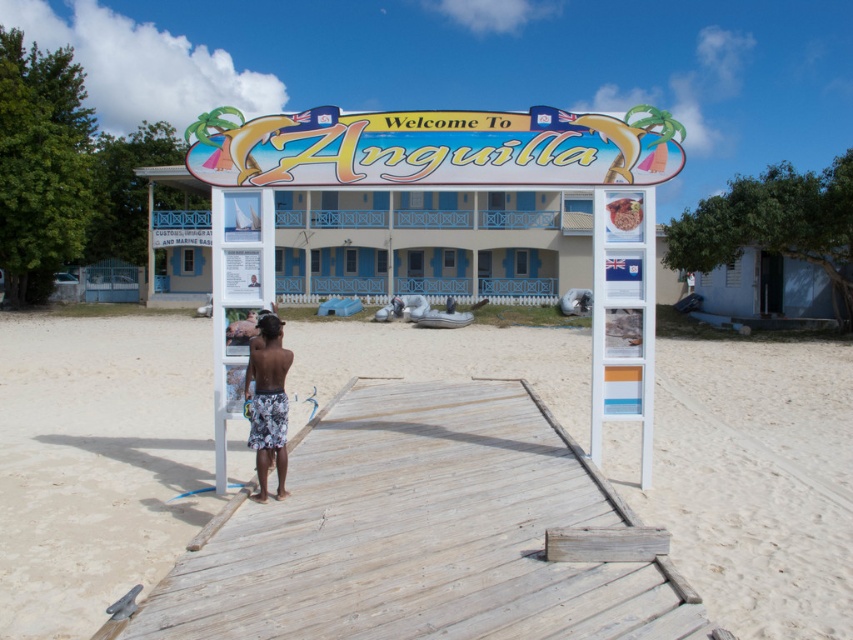
Question: Does weathered wood dock at center have a lesser width compared to white floral shorts at center?

Choices:
 (A) yes
 (B) no

Answer: (B)

Question: Can you confirm if weathered wood dock at center is positioned to the left of white floral shorts at center?

Choices:
 (A) yes
 (B) no

Answer: (B)

Question: Is weathered wood dock at center wider than white floral shorts at center?

Choices:
 (A) no
 (B) yes

Answer: (B)

Question: Which of the following is the farthest from the observer?

Choices:
 (A) weathered wood dock at center
 (B) white floral shorts at center

Answer: (B)

Question: Which point is farther to the camera?

Choices:
 (A) white floral shorts at center
 (B) weathered wood dock at center

Answer: (A)